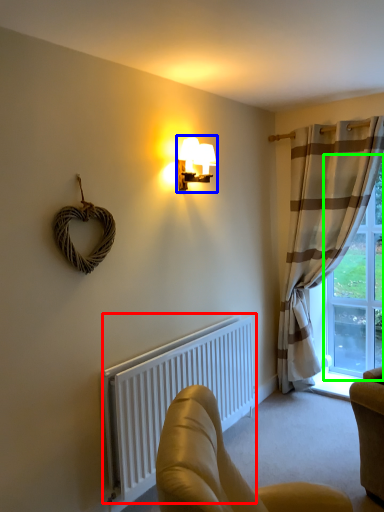
Question: Which object is the closest to the radiator (highlighted by a red box)? Choose among these: lamp (highlighted by a blue box) or window (highlighted by a green box).

Choices:
 (A) lamp
 (B) window

Answer: (A)